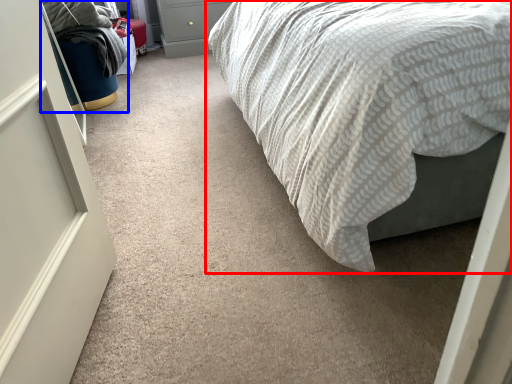
Question: Which object is closer to the camera taking this photo, bed (highlighted by a red box) or bean bag chair (highlighted by a blue box)?

Choices:
 (A) bed
 (B) bean bag chair

Answer: (A)